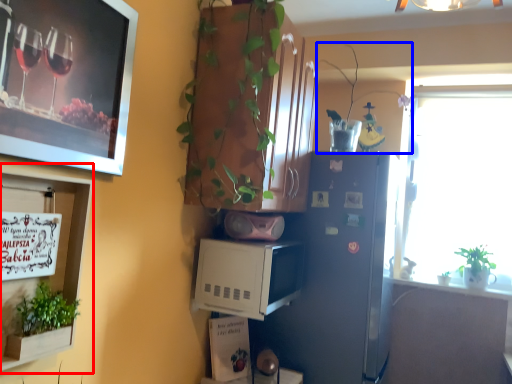
Question: Among these objects, which one is nearest to the camera, shelf (highlighted by a red box) or houseplant (highlighted by a blue box)?

Choices:
 (A) shelf
 (B) houseplant

Answer: (A)